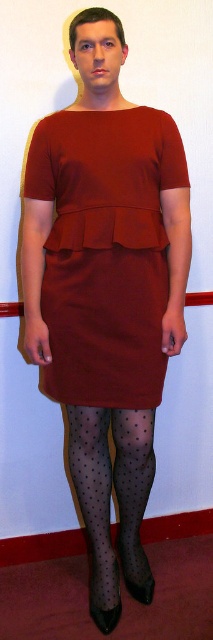
Which is below, burgundy matte dress at center or transparent polka dot tights at lower center?

Positioned lower is transparent polka dot tights at lower center.

Who is positioned more to the left, burgundy matte dress at center or transparent polka dot tights at lower center?

burgundy matte dress at center

Who is more distant from viewer, (63, 332) or (82, 513)?

The point (82, 513) is more distant.

Identify the location of burgundy matte dress at center. (106, 252).